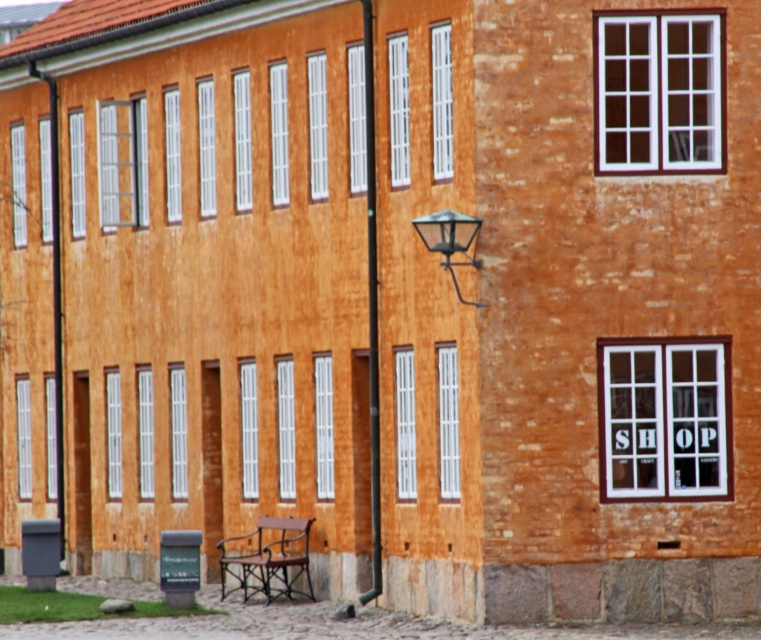
Who is lower down, wooden park bench at lower center or black glass lamp at center?

Positioned lower is wooden park bench at lower center.

Does wooden park bench at lower center have a larger size compared to black glass lamp at center?

Indeed, wooden park bench at lower center has a larger size compared to black glass lamp at center.

The width and height of the screenshot is (761, 640). Describe the element at coordinates (268, 557) in the screenshot. I see `wooden park bench at lower center` at that location.

Locate an element on the screen. This screenshot has width=761, height=640. wooden park bench at lower center is located at coordinates (268, 557).

Between metallic black lamp post at left and black glass lamp at center, which one has more height?

Standing taller between the two is metallic black lamp post at left.

Between metallic black lamp post at left and black glass lamp at center, which one appears on the left side from the viewer's perspective?

From the viewer's perspective, metallic black lamp post at left appears more on the left side.

This screenshot has width=761, height=640. I want to click on metallic black lamp post at left, so click(56, 294).

Can you confirm if wooden park bench at lower center is positioned below metallic black lamp post at left?

No.

Who is positioned more to the left, wooden park bench at lower center or metallic black lamp post at left?

Positioned to the left is metallic black lamp post at left.

Is point (266, 572) positioned behind point (61, 452)?

No, (266, 572) is in front of (61, 452).

Identify the location of wooden park bench at lower center. (268, 557).